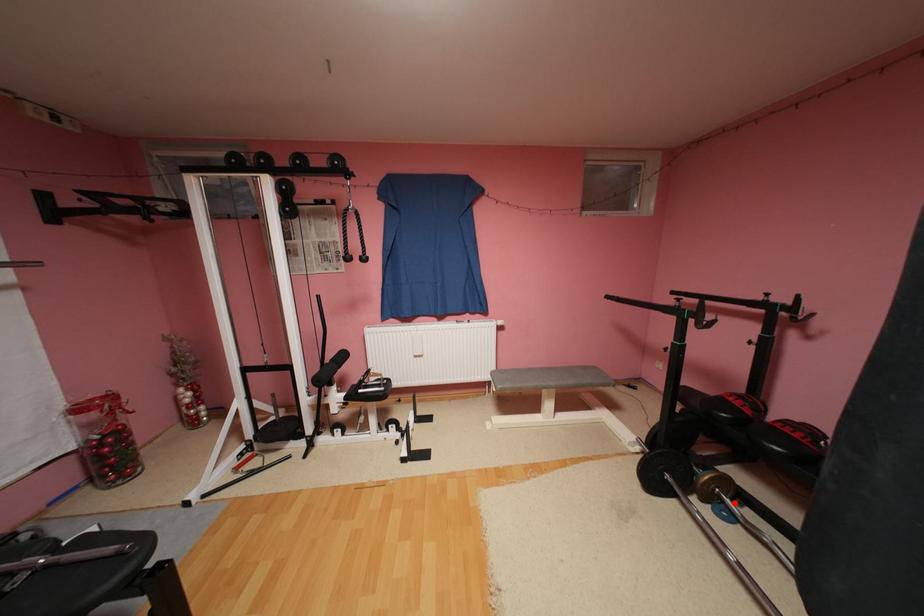
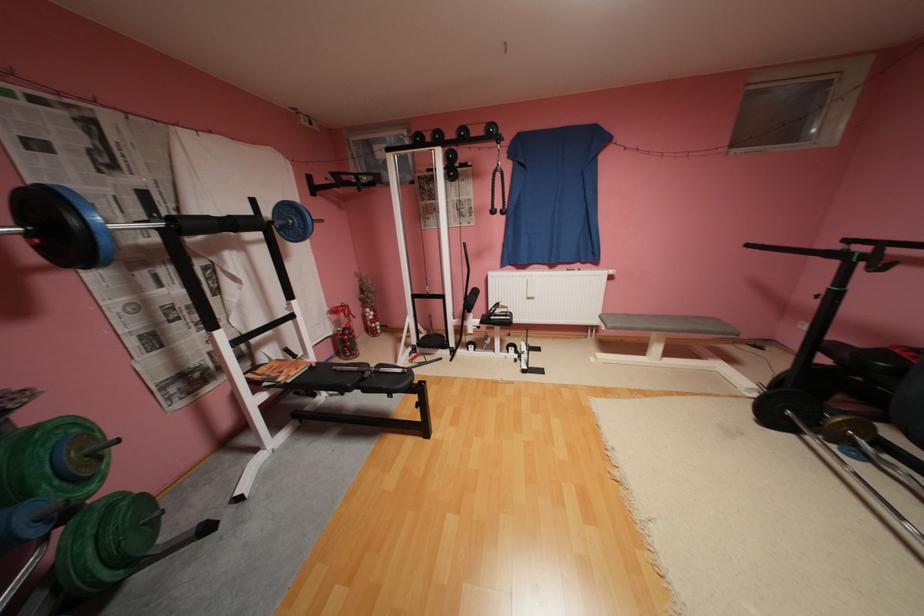
Question: A red point is marked in image1. In image2, is the corresponding 3D point closer to the camera or farther? Reply with the corresponding letter.

Choices:
 (A) The corresponding 3D point is closer.
 (B) The corresponding 3D point is farther.

Answer: (B)